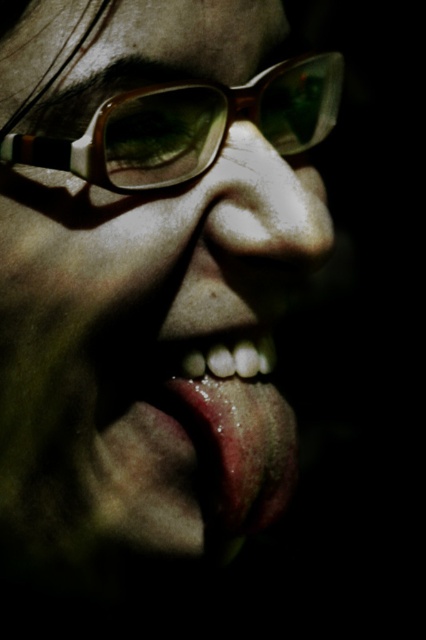
Question: Does matte plastic glasses at upper center have a smaller size compared to shiny pink lips at center?

Choices:
 (A) yes
 (B) no

Answer: (B)

Question: Can you confirm if matte plastic glasses at upper center is positioned above shiny pink lips at center?

Choices:
 (A) no
 (B) yes

Answer: (B)

Question: Among these objects, which one is farthest from the camera?

Choices:
 (A) matte brown glasses at upper center
 (B) matte plastic glasses at upper center

Answer: (B)

Question: Which point is closer to the camera?

Choices:
 (A) (227, 515)
 (B) (302, 97)
 (C) (238, 193)
 (D) (238, 464)

Answer: (C)

Question: Does matte brown glasses at upper center have a lesser width compared to smooth skin nose at center?

Choices:
 (A) no
 (B) yes

Answer: (A)

Question: Which point appears farthest from the camera in this image?

Choices:
 (A) (261, 481)
 (B) (213, 140)

Answer: (A)